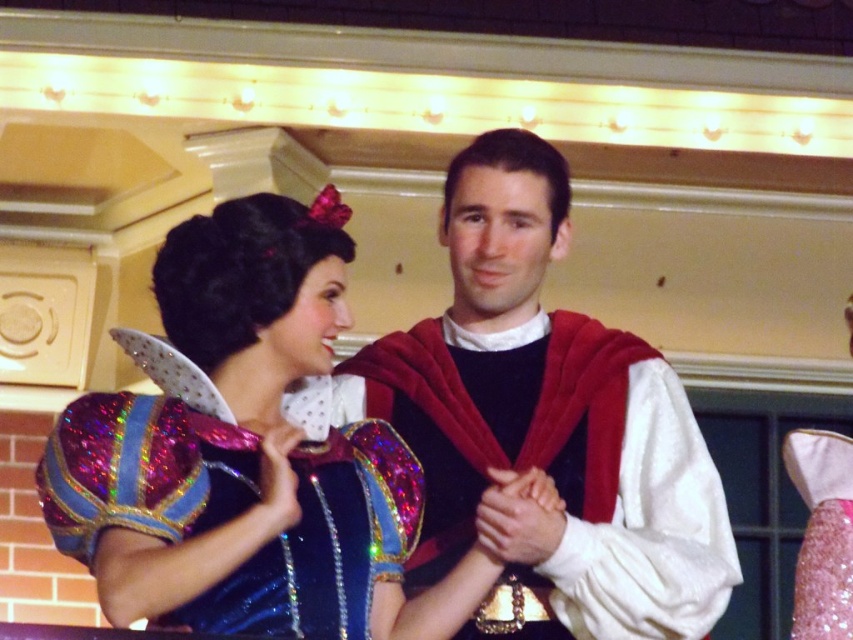
You are a photographer at the event and want to ensure that both the velvet red cape at center and the pink glitter dress at center are visible in your photo. Based on their positions, which one is more likely to be fully visible in the frame?

The velvet red cape at center is located above the pink glitter dress at center, so the velvet red cape at center is more likely to be fully visible in the frame since it is positioned higher up.

You are a photographer standing at the back of the stage. You want to take a closeup shot of the sparkly blue dress at center. Considering your current position, do you think you can capture the dress clearly without moving closer?

The sparkly blue dress at center is 39.81 meters away from the camera. Since this distance is quite far, it might be challenging to capture the dress clearly in a closeup shot without moving closer.

You are an audience member sitting in the front row of the stage. You notice two points marked in the scene. One is at coordinate point (67, 513) and the other is at point (430, 396). Which point is closer to you?

The point at coordinate (67, 513) is closer to the viewer than the point at (430, 396).